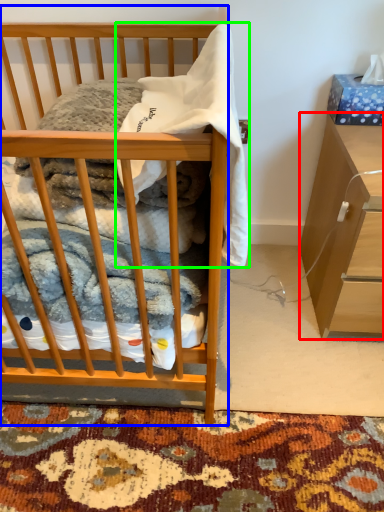
Question: Based on their relative distances, which object is farther from cabinetry (highlighted by a red box)? Choose from desk (highlighted by a blue box) and baby clothe (highlighted by a green box).

Choices:
 (A) desk
 (B) baby clothe

Answer: (A)